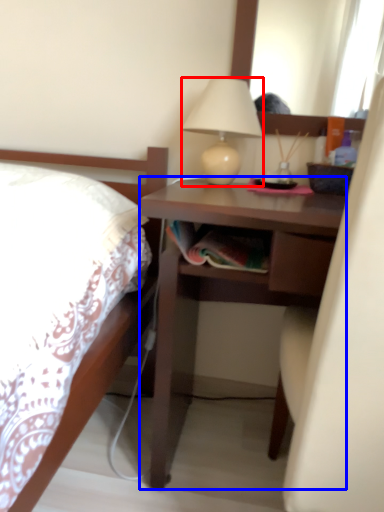
Question: Which of the following is the farthest to the observer, lamp (highlighted by a red box) or desk (highlighted by a blue box)?

Choices:
 (A) lamp
 (B) desk

Answer: (A)